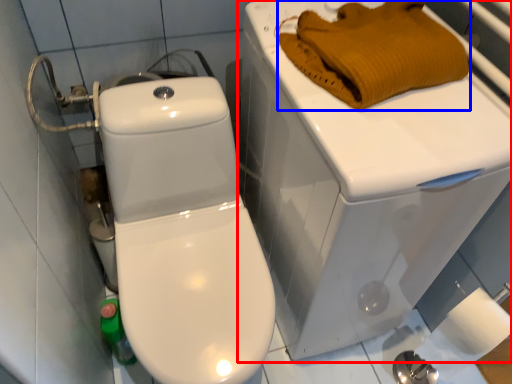
Question: Among these objects, which one is farthest to the camera, porcelain (highlighted by a red box) or material (highlighted by a blue box)?

Choices:
 (A) porcelain
 (B) material

Answer: (B)